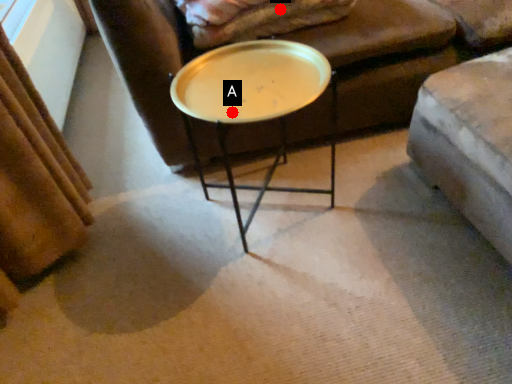
Question: Two points are circled on the image, labeled by A and B beside each circle. Which point is further to the camera?

Choices:
 (A) A is further
 (B) B is further

Answer: (B)